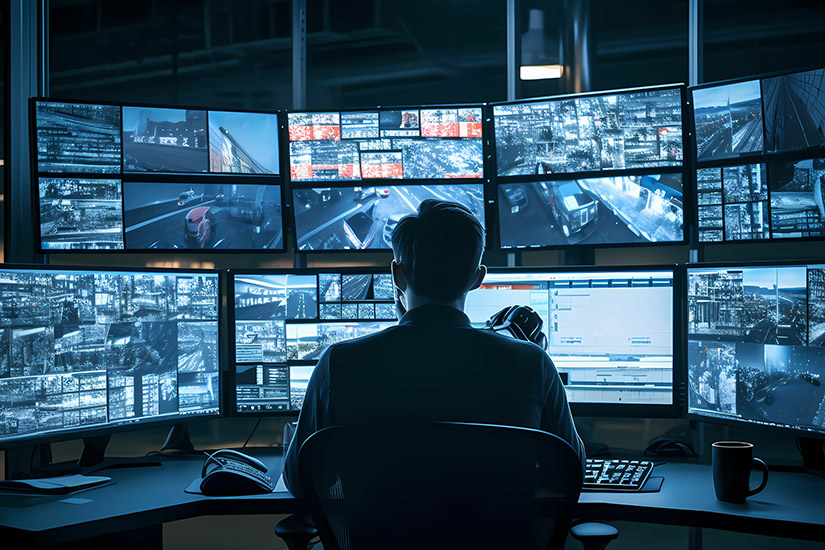
I want to click on monitors, so click(x=105, y=359), click(x=177, y=181), click(x=365, y=177), click(x=602, y=166), click(x=766, y=164), click(x=784, y=351), click(x=620, y=324), click(x=314, y=319).